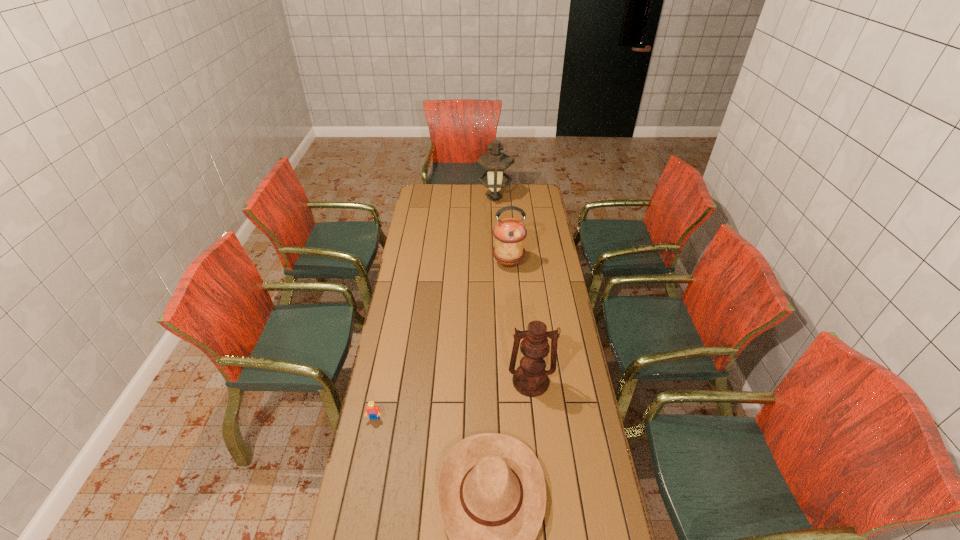
Locate an element on the screen. This screenshot has height=540, width=960. object that is at the left edge is located at coordinates (373, 411).

The image size is (960, 540). Find the location of `object present at the right edge`. object present at the right edge is located at coordinates (531, 379).

You are a GUI agent. You are given a task and a screenshot of the screen. Output one action in this format:
    pyautogui.click(x=<x>, y=<y>)
    Task: Click on the free space at the far edge
    
    Given the screenshot: What is the action you would take?
    pyautogui.click(x=512, y=204)

I want to click on free region at the left edge of the desktop, so click(x=411, y=222).

Identify the location of free space at the right edge of the desktop. This screenshot has height=540, width=960. (564, 428).

Where is `free region at the far left corner of the desktop`? The image size is (960, 540). free region at the far left corner of the desktop is located at coordinates (438, 184).

Locate an element on the screen. vacant area that lies between the farthest object and the fourth farthest object is located at coordinates (435, 308).

Point out which object is positioned as the third nearest to the second nearest object. Please provide its 2D coordinates. Your answer should be formatted as a tuple, i.e. [(x, y)], where the tuple contains the x and y coordinates of a point satisfying the conditions above.

[(509, 233)]

Identify which object is the fourth nearest to the third nearest object. Please provide its 2D coordinates. Your answer should be formatted as a tuple, i.e. [(x, y)], where the tuple contains the x and y coordinates of a point satisfying the conditions above.

[(495, 162)]

The width and height of the screenshot is (960, 540). In order to click on oil lamp that is the second closest one to the fourth nearest object in this screenshot , I will do `click(531, 379)`.